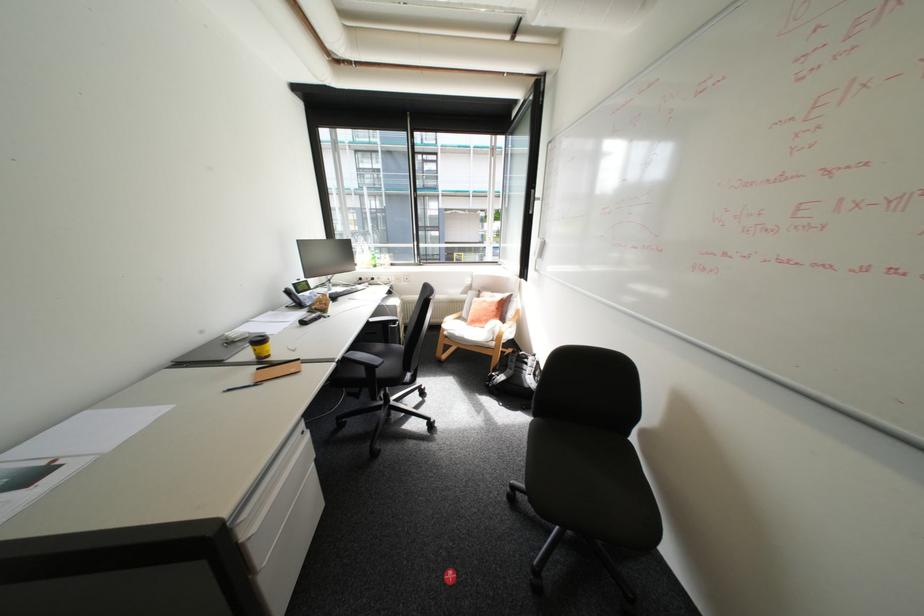
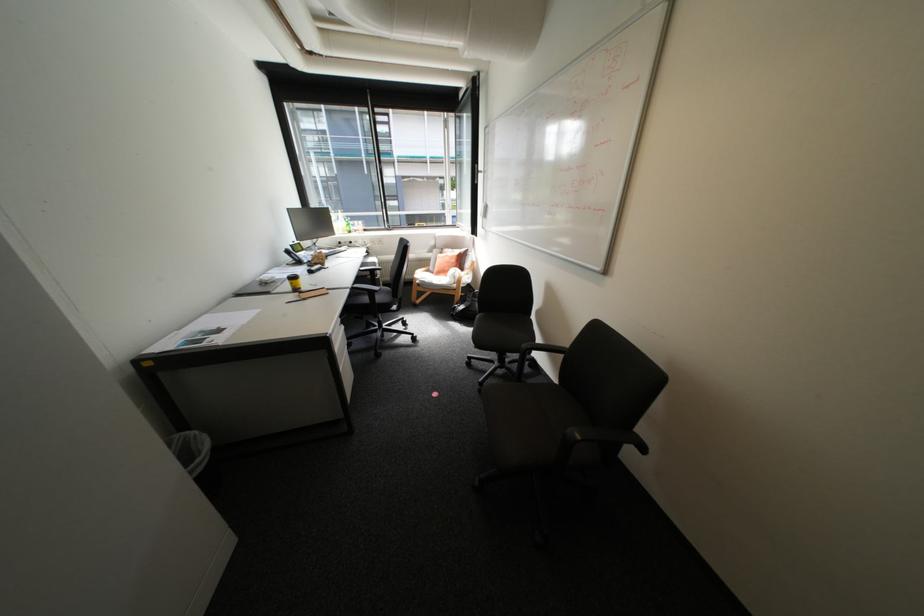
Where in the second image is the point corresponding to (545,572) from the first image?

(491, 384)